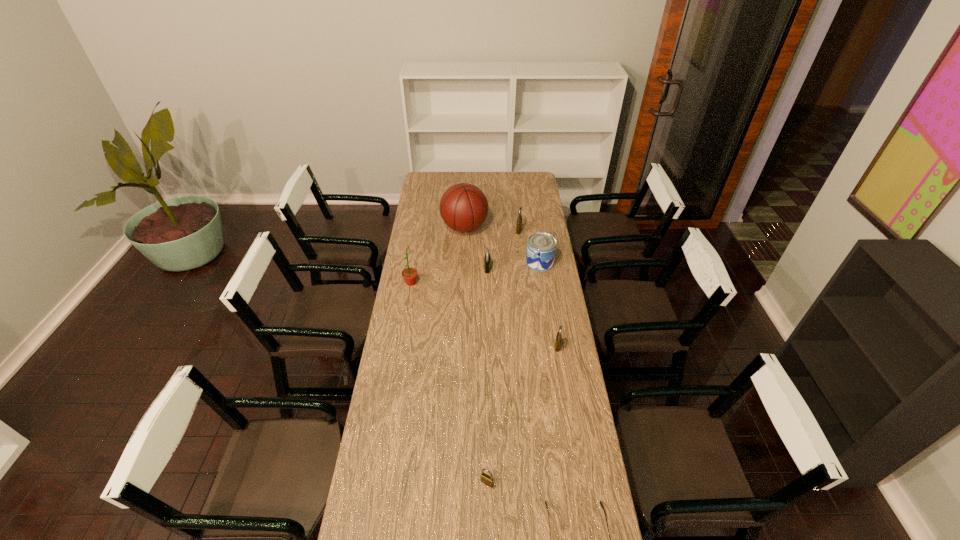
Identify the location of object at the left edge. The width and height of the screenshot is (960, 540). (409, 274).

Where is `can situated at the right edge`? The width and height of the screenshot is (960, 540). can situated at the right edge is located at coordinates [x=541, y=247].

At what (x,y) coordinates should I click in order to perform the action: click on vacant region at the far edge. Please return your answer as a coordinate pair (x, y). The image size is (960, 540). Looking at the image, I should click on (x=515, y=186).

The height and width of the screenshot is (540, 960). Identify the location of free point at the left edge. (384, 506).

The width and height of the screenshot is (960, 540). In the image, there is a desktop. What are the coordinates of `vacant space at the right edge` in the screenshot? It's located at (532, 209).

This screenshot has width=960, height=540. In the image, there is a desktop. Find the location of `vacant space at the far left corner`. vacant space at the far left corner is located at coordinates (425, 190).

Find the location of a particular element. This screenshot has width=960, height=540. vacant space in between the nearest brass padlock and the rightmost brass padlock is located at coordinates (522, 414).

You are a GUI agent. You are given a task and a screenshot of the screen. Output one action in this format:
    pyautogui.click(x=<x>, y=<y>)
    Task: Click on the vacant area between the brown basketball and the farthest brass padlock
    
    Given the screenshot: What is the action you would take?
    click(x=492, y=229)

Locate an element on the screen. The image size is (960, 540). empty space that is in between the basketball and the sixth farthest object is located at coordinates (511, 287).

Image resolution: width=960 pixels, height=540 pixels. Identify the location of free spot between the shortest padlock and the blue can. (514, 373).